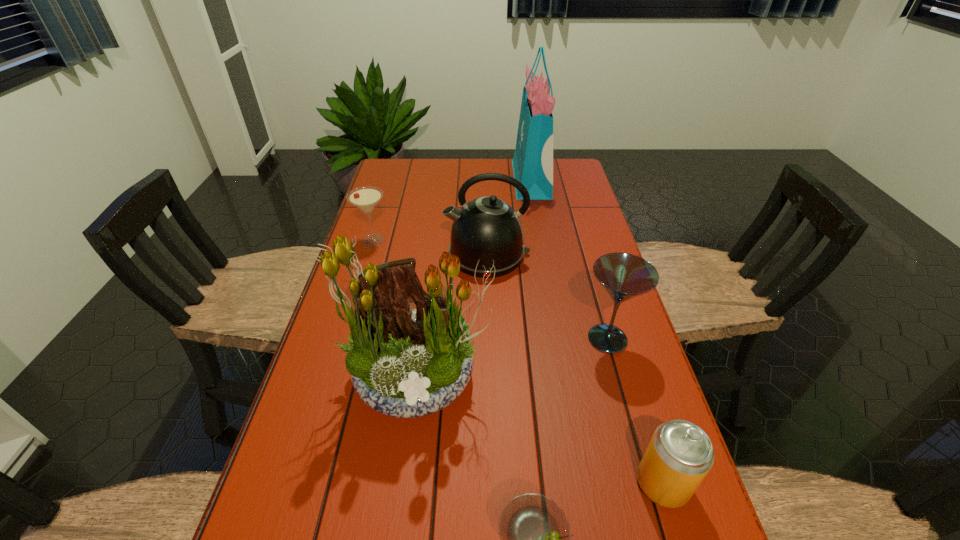
At what (x,y) coordinates should I click in order to perform the action: click on vacant space situated on the spout of the third tallest object. Please return your answer as a coordinate pair (x, y). The height and width of the screenshot is (540, 960). Looking at the image, I should click on (404, 254).

What are the coordinates of `vacant space located on the spout of the third tallest object` in the screenshot? It's located at (424, 254).

What are the coordinates of `vacant space positioned 0.200m on the spout of the third tallest object` in the screenshot? It's located at (378, 254).

What are the coordinates of `vacant space situated 0.250m on the left of the tallest martini` in the screenshot? It's located at (476, 339).

Locate an element on the screen. free location located 0.150m on the back of the farthest martini is located at coordinates (384, 206).

In order to click on vacant space situated 0.050m on the back of the pop (soda) in this screenshot , I will do `click(647, 434)`.

Identify the location of object at the far edge. This screenshot has width=960, height=540. (532, 163).

You are a GUI agent. You are given a task and a screenshot of the screen. Output one action in this format:
    pyautogui.click(x=<x>, y=<y>)
    Task: Click on the flower arrangement at the left edge
    The image size is (960, 540).
    Given the screenshot: What is the action you would take?
    pyautogui.click(x=406, y=364)

Image resolution: width=960 pixels, height=540 pixels. Identify the location of martini that is at the left edge. (366, 198).

Where is `shopping bag positioned at the right edge`? shopping bag positioned at the right edge is located at coordinates (532, 163).